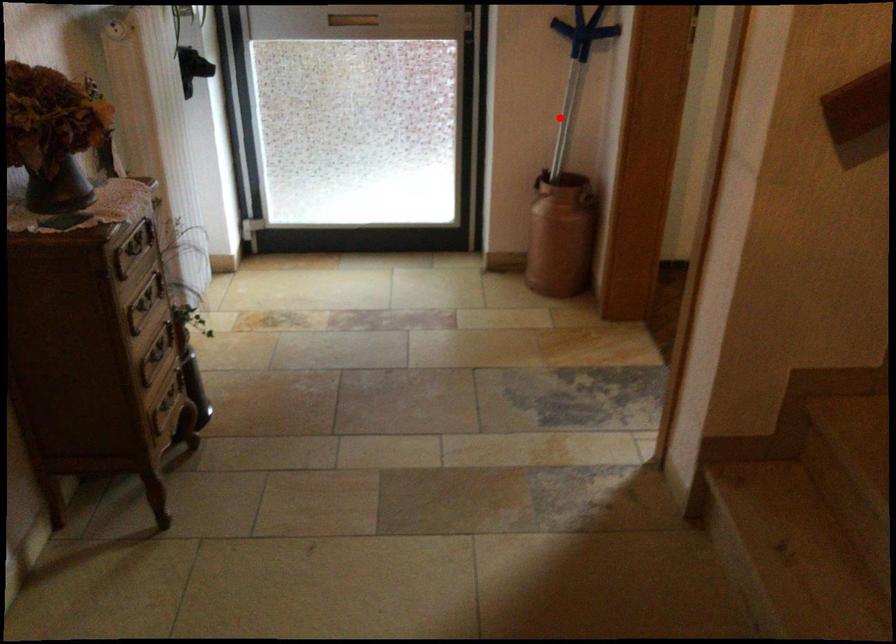
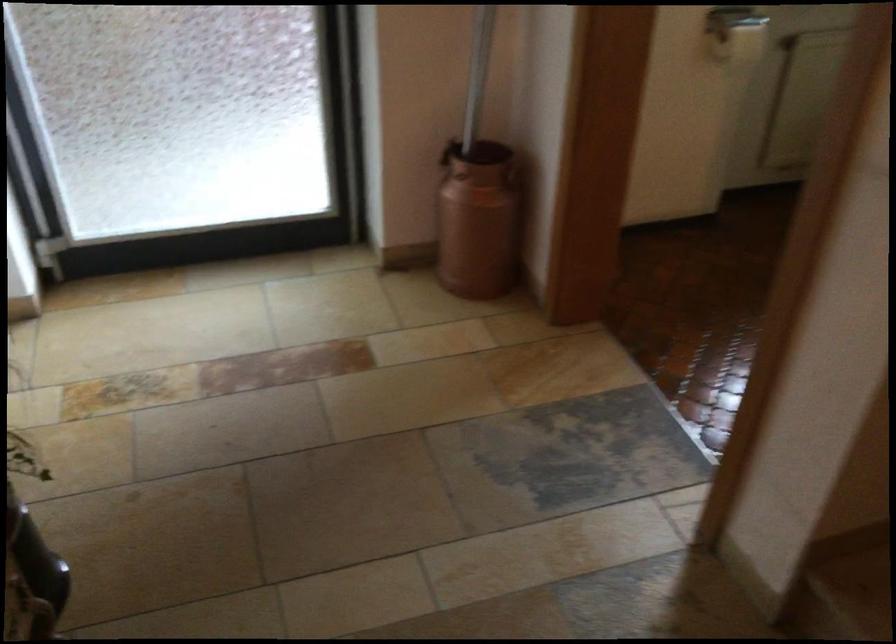
In the second image, find the point that corresponds to the highlighted location in the first image.

(478, 73)